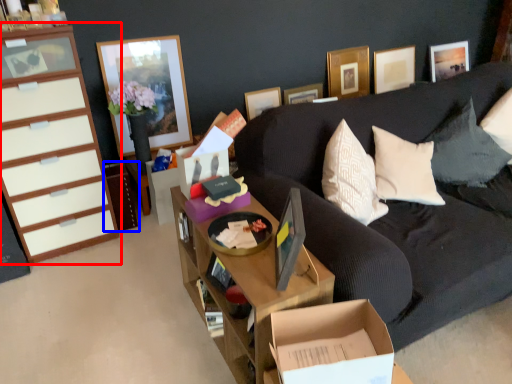
Question: Which of the following is the farthest to the observer, cabinetry (highlighted by a red box) or cabinetry (highlighted by a blue box)?

Choices:
 (A) cabinetry
 (B) cabinetry

Answer: (B)